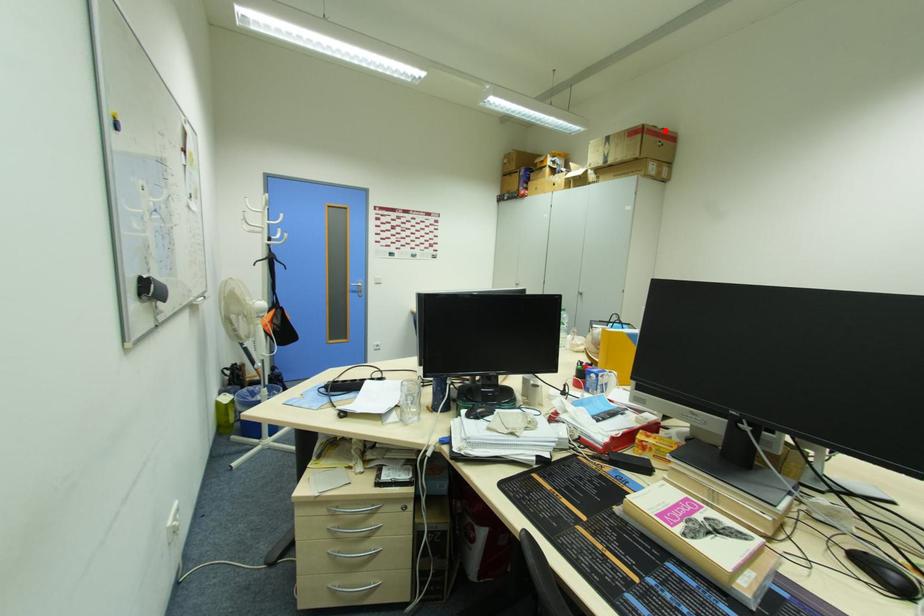
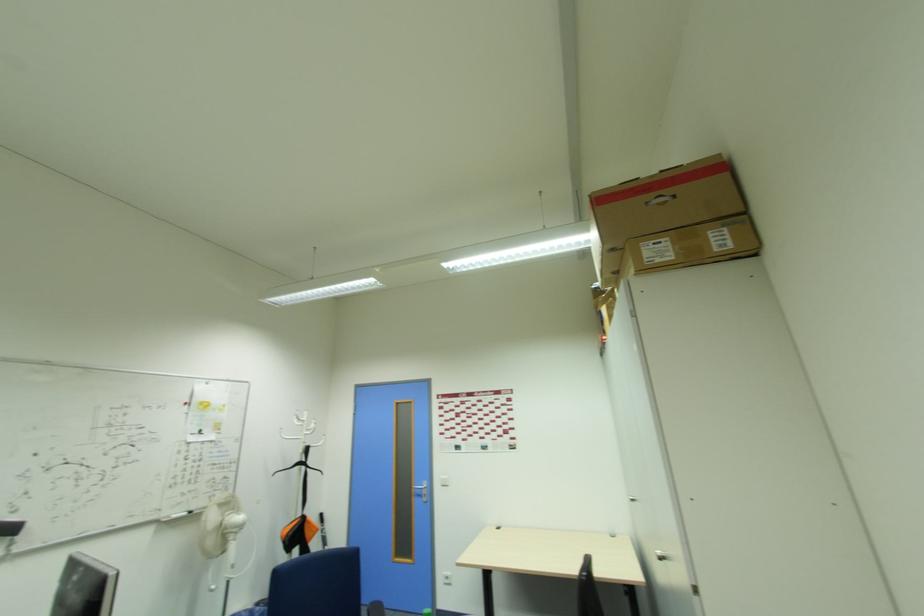
The point at the highlighted location is marked in the first image. Where is the corresponding point in the second image?

(665, 172)